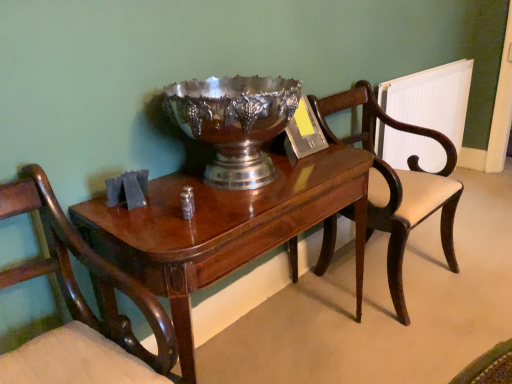
You are a GUI agent. You are given a task and a screenshot of the screen. Output one action in this format:
    pyautogui.click(x=<x>, y=<y>)
    Task: Click on the free location to the right of mahogany wood chair at right, which is the 1th chair in right-to-left order
    
    Given the screenshot: What is the action you would take?
    pyautogui.click(x=464, y=266)